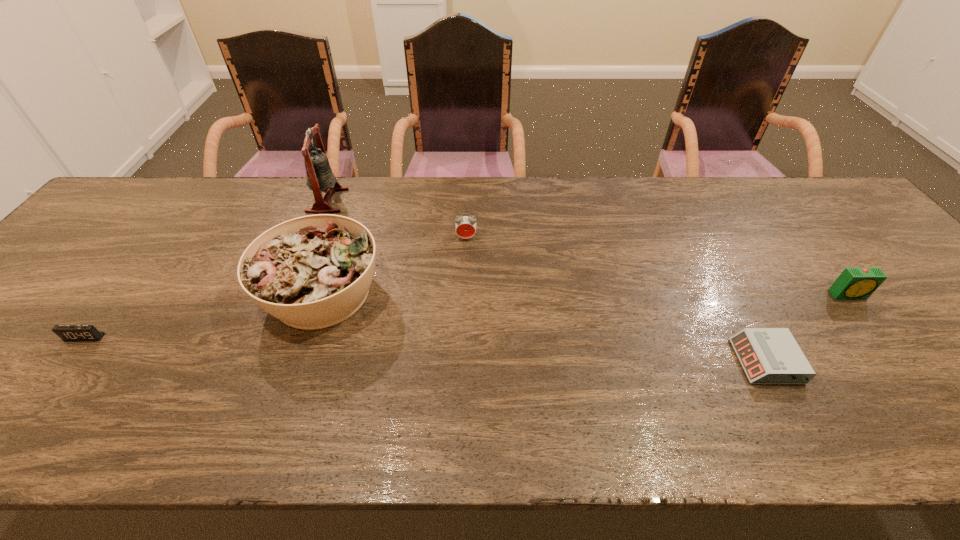
Identify which object is located as the fifth nearest to the bell. Please provide its 2D coordinates. Your answer should be formatted as a tuple, i.e. [(x, y)], where the tuple contains the x and y coordinates of a point satisfying the conditions above.

[(854, 282)]

Choose which object is the fifth nearest neighbor to the bell. Please provide its 2D coordinates. Your answer should be formatted as a tuple, i.e. [(x, y)], where the tuple contains the x and y coordinates of a point satisfying the conditions above.

[(854, 282)]

Locate an element on the screen. The image size is (960, 540). alarm clock object that ranks as the second closest to the second alarm clock from right to left is located at coordinates (465, 226).

In order to click on alarm clock that is the closest one to the rightmost object in this screenshot , I will do `click(768, 355)`.

This screenshot has width=960, height=540. Find the location of `blank space that satisfies the following two spatial constraints: 1. on the front-facing side of the leftmost object; 2. on the right side of the third alarm clock from left to right`. blank space that satisfies the following two spatial constraints: 1. on the front-facing side of the leftmost object; 2. on the right side of the third alarm clock from left to right is located at coordinates (66, 361).

Image resolution: width=960 pixels, height=540 pixels. I want to click on vacant space that satisfies the following two spatial constraints: 1. on the front-facing side of the leftmost alarm clock; 2. on the right side of the fifth object from left to right, so click(66, 361).